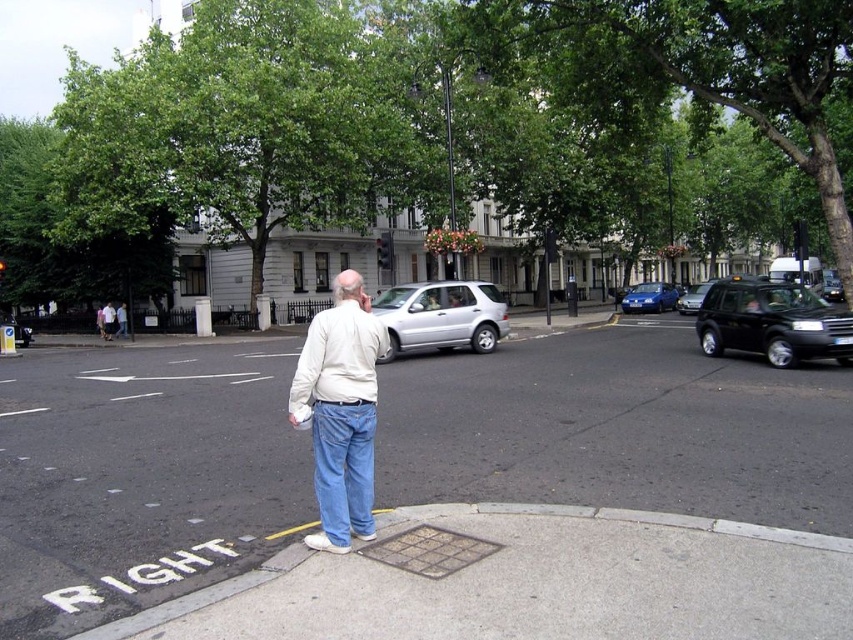
Question: Which point is farther to the camera?

Choices:
 (A) pyautogui.click(x=363, y=380)
 (B) pyautogui.click(x=752, y=339)
 (C) pyautogui.click(x=689, y=300)
 (D) pyautogui.click(x=430, y=301)

Answer: (C)

Question: Is white cotton shirt at center further to the viewer compared to metallic blue hatchback at right?

Choices:
 (A) no
 (B) yes

Answer: (A)

Question: Which object appears farthest from the camera in this image?

Choices:
 (A) white cotton shirt at center
 (B) white matte car at center
 (C) black metallic taxi at right

Answer: (C)

Question: In this image, where is white matte car at center located relative to black metallic taxi at right?

Choices:
 (A) below
 (B) above

Answer: (A)

Question: Does white cotton shirt at center appear on the right side of satin silver suv at center?

Choices:
 (A) yes
 (B) no

Answer: (B)

Question: Which of the following is the closest to the observer?

Choices:
 (A) (397, 296)
 (B) (775, 362)
 (C) (647, 304)
 (D) (695, 298)

Answer: (B)